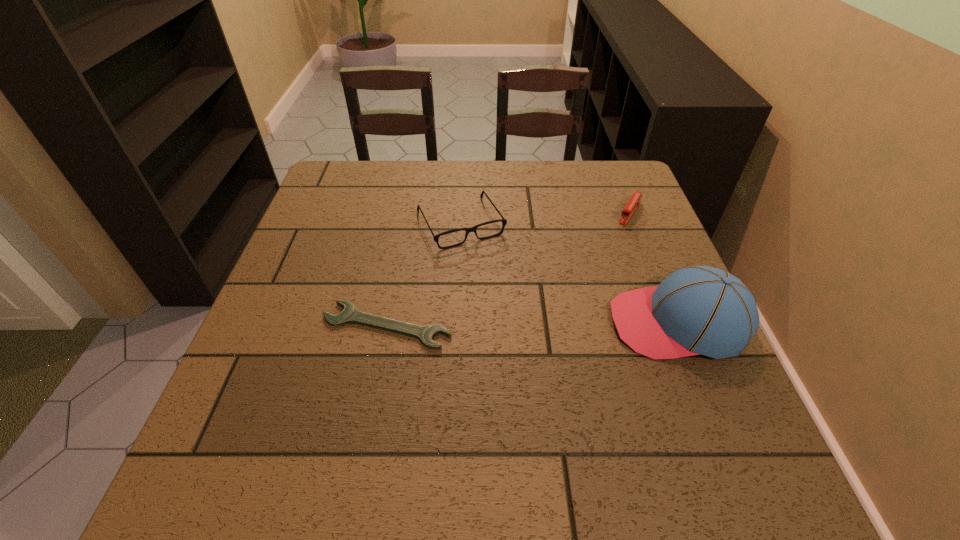
The height and width of the screenshot is (540, 960). I want to click on vacant area that lies between the wrench and the spectacles, so click(423, 274).

This screenshot has width=960, height=540. In order to click on vacant space in between the wrench and the spectacles in this screenshot , I will do `click(423, 274)`.

Locate an element on the screen. The width and height of the screenshot is (960, 540). vacant space that's between the spectacles and the shortest object is located at coordinates (423, 274).

This screenshot has height=540, width=960. In order to click on vacant area that lies between the shortest object and the spectacles in this screenshot , I will do `click(423, 274)`.

The image size is (960, 540). In order to click on vacant area between the wrench and the stapler in this screenshot , I will do `click(508, 269)`.

The width and height of the screenshot is (960, 540). I want to click on vacant space that is in between the shortest object and the spectacles, so click(x=423, y=274).

Find the location of a particular element. The image size is (960, 540). object identified as the third closest to the spectacles is located at coordinates (630, 208).

Image resolution: width=960 pixels, height=540 pixels. Identify the location of the second closest object to the shortest object. (695, 310).

Image resolution: width=960 pixels, height=540 pixels. Find the location of `vacant space that satisfies the following two spatial constraints: 1. on the front side of the baseball cap; 2. on the front-facing side of the spectacles`. vacant space that satisfies the following two spatial constraints: 1. on the front side of the baseball cap; 2. on the front-facing side of the spectacles is located at coordinates (455, 323).